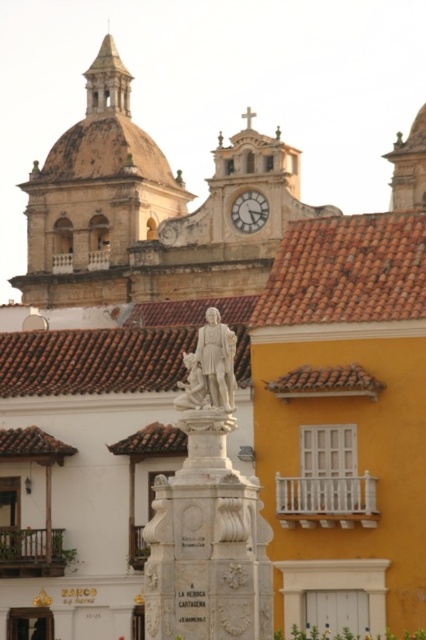
Does brown stone dome at upper center appear on the right side of white marble statue at center?

No, brown stone dome at upper center is not to the right of white marble statue at center.

Between point (146, 164) and point (222, 410), which one is positioned behind?

Positioned behind is point (146, 164).

Which is behind, point (89, 282) or point (207, 380)?

Positioned behind is point (89, 282).

Identify the location of brown stone dome at upper center. (97, 196).

Who is positioned more to the left, brown stone dome at upper center or white marble clock at upper center?

brown stone dome at upper center is more to the left.

Who is lower down, brown stone dome at upper center or white marble clock at upper center?

white marble clock at upper center is below.

The image size is (426, 640). I want to click on brown stone dome at upper center, so click(97, 196).

What are the coordinates of `white marble statue at center` in the screenshot? It's located at (210, 368).

This screenshot has width=426, height=640. What do you see at coordinates (210, 368) in the screenshot?
I see `white marble statue at center` at bounding box center [210, 368].

Where is `white marble statue at center`? This screenshot has width=426, height=640. white marble statue at center is located at coordinates (210, 368).